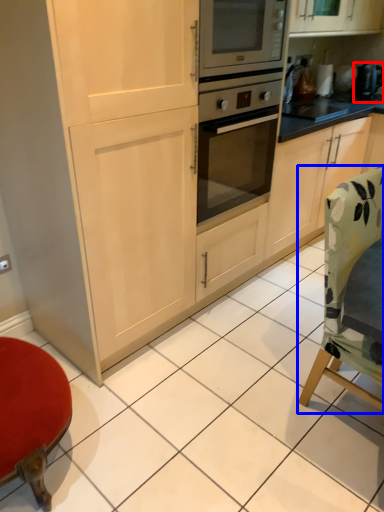
Question: Which object appears closest to the camera in this image, appliance (highlighted by a red box) or chair (highlighted by a blue box)?

Choices:
 (A) appliance
 (B) chair

Answer: (B)